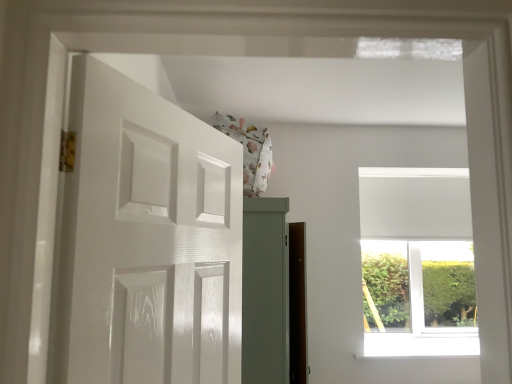
Question: From a real-world perspective, is white glossy door at left physically located above or below white matte window at upper right?

Choices:
 (A) above
 (B) below

Answer: (A)

Question: Based on their sizes in the image, would you say white glossy door at left is bigger or smaller than white matte window at upper right?

Choices:
 (A) small
 (B) big

Answer: (A)

Question: Which object is positioned closest to the white matte window at upper right?

Choices:
 (A) white smooth window sill at upper center
 (B) white glossy door at left

Answer: (A)

Question: Which of these objects is positioned closest to the white smooth window sill at upper center?

Choices:
 (A) white matte window at upper right
 (B) white glossy door at left

Answer: (A)